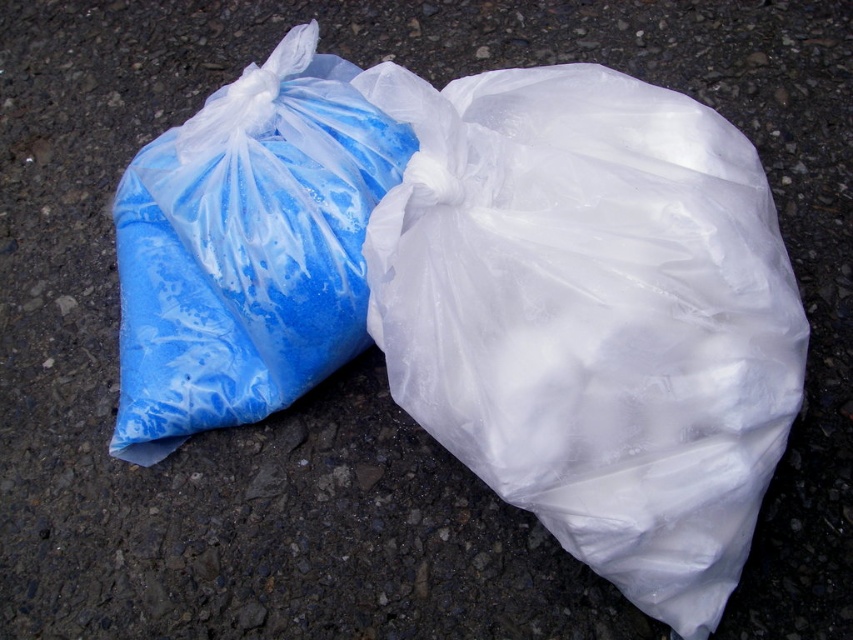
You have two plastic bags in front of you on the asphalt. The transparent plastic bag at center and the blue matte plastic bag at left. Which one is wider?

The blue matte plastic bag at left is wider than the transparent plastic bag at center.

In the scene shown: You are a delivery person who needs to stack these two bags for transport. The transparent plastic bag at center and the blue matte plastic bag at left must be placed one on top of the other. Based on their sizes, which bag should be placed at the bottom to ensure stability?

The transparent plastic bag at center is taller than the blue matte plastic bag at left, so placing the taller transparent plastic bag at center at the bottom will provide a larger base for stability.